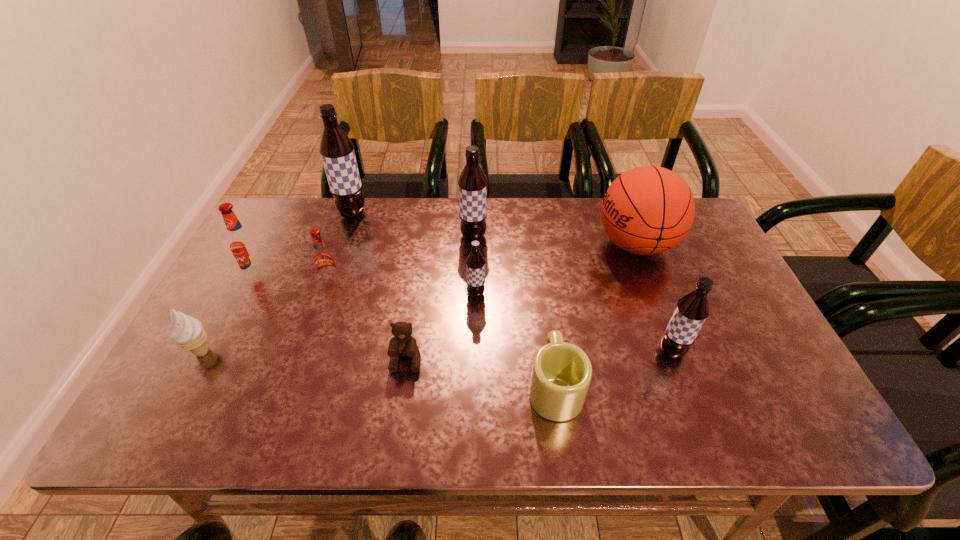
Image resolution: width=960 pixels, height=540 pixels. I want to click on the third farthest brown root beer, so click(475, 263).

What are the coordinates of `icecream` in the screenshot? It's located at (187, 331).

I want to click on the eighth object from left to right, so click(x=561, y=374).

At what (x,y) coordinates should I click in order to perform the action: click on beige mug. Please return your answer as a coordinate pair (x, y). The height and width of the screenshot is (540, 960). Looking at the image, I should click on (561, 374).

This screenshot has width=960, height=540. Find the location of `teddy bear`. teddy bear is located at coordinates (402, 344).

The image size is (960, 540). Find the location of `blank space located on the right of the farthest brown root beer`. blank space located on the right of the farthest brown root beer is located at coordinates (428, 213).

What are the coordinates of `free space located on the back of the second farthest brown root beer` in the screenshot? It's located at (474, 200).

I want to click on free spot located 0.370m on the side with logo of the basketball, so click(472, 245).

At what (x,y) coordinates should I click in order to perform the action: click on vacant space located on the side with logo of the basketball. Please return your answer as a coordinate pair (x, y). This screenshot has height=540, width=960. Looking at the image, I should click on tap(532, 245).

The width and height of the screenshot is (960, 540). What are the coordinates of `vacant area located 0.240m on the side with logo of the basketball` in the screenshot? It's located at (516, 245).